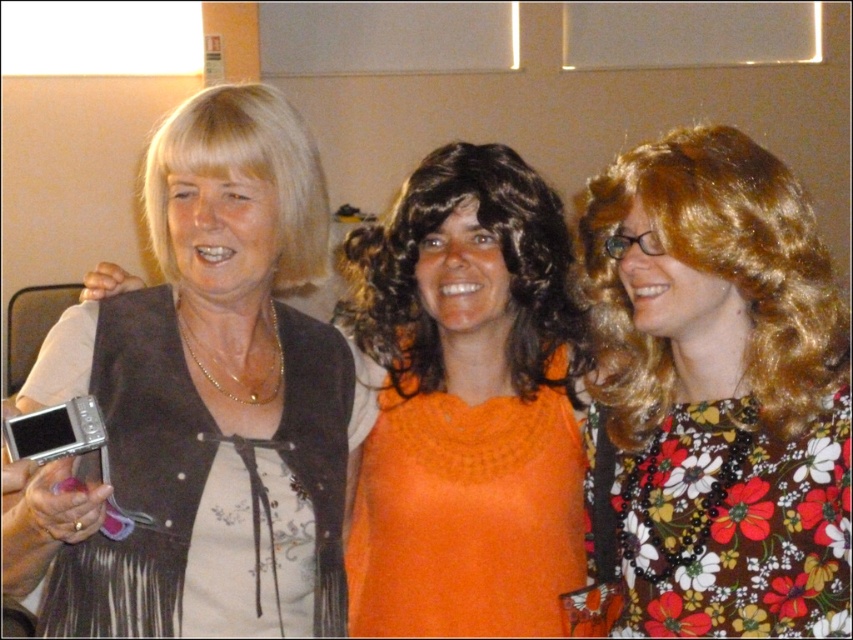
Based on the scene description, which object is taller between the matte black vest at left and the floral print dress at center?

The matte black vest at left is taller than the floral print dress at center according to the description.

Consider the image. You are a photographer trying to capture the floral print dress at center in the image. The camera you are using has a rectangular viewfinder with coordinates ranging from 0 to 1 on both the x and y axes. The point at coordinates (x=712, y=397) marks the center of the floral print dress at center. If you want to frame the dress so that its center is exactly at the center of your viewfinder, which has coordinates 0.5, 0.5, should you move the camera to the left or right along the x axis and up or down along y?

The point (x=712, y=397) is to the right and above the center of the viewfinder at 0.5, 0.5. To center the floral print dress at center, you should move the camera to the left along the x axis and down along the y axis so that the point aligns with 0.5, 0.5.

You are a photographer trying to capture a group photo of the matte black vest at left and the orange knitted sweater at center. You want to ensure both are fully visible in the frame. Based on their widths, which one might require you to adjust your camera angle to avoid being cut off?

The matte black vest at left might be wider than the orange knitted sweater at center, so you might need to adjust your camera angle to ensure the matte black vest at left is fully visible in the frame.